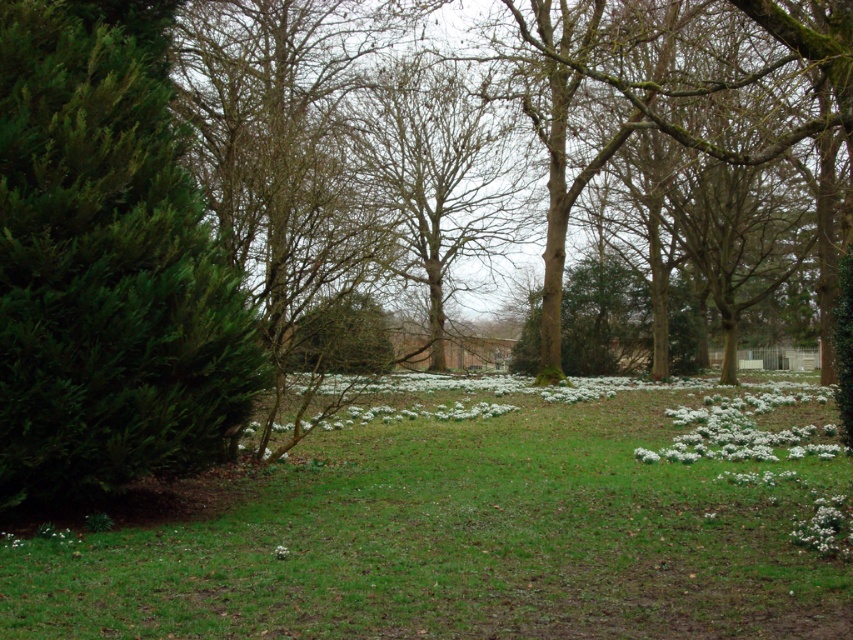
Question: Is green needle-like at left to the left of white matte flowers at lower right from the viewer's perspective?

Choices:
 (A) yes
 (B) no

Answer: (A)

Question: Which point appears closest to the camera in this image?

Choices:
 (A) (701, 401)
 (B) (804, 532)
 (C) (83, 65)

Answer: (B)

Question: Is white matte flowers at lower right to the right of white matte flower at lower right from the viewer's perspective?

Choices:
 (A) no
 (B) yes

Answer: (B)

Question: Which object is closer to the camera taking this photo?

Choices:
 (A) green needle-like at left
 (B) white matte flower at lower right
 (C) white matte flowers at lower right

Answer: (B)

Question: Which of the following is the farthest from the observer?

Choices:
 (A) (96, 388)
 (B) (799, 440)

Answer: (B)

Question: Can you confirm if white matte flowers at lower right is positioned to the right of white matte flower at lower right?

Choices:
 (A) yes
 (B) no

Answer: (A)